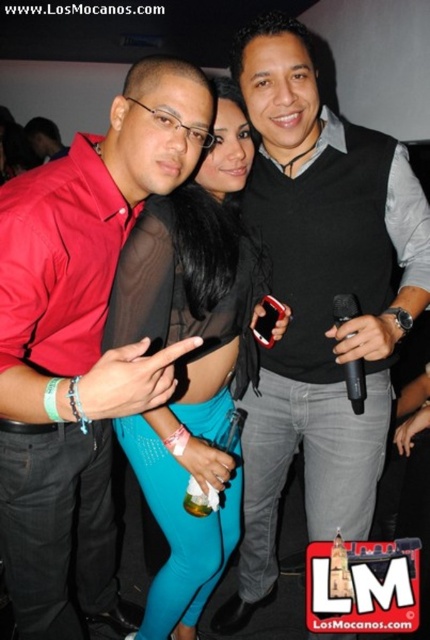
Question: Which object appears farthest from the camera in this image?

Choices:
 (A) black plastic microphone at right
 (B) satin black top at center
 (C) black matte vest at center

Answer: (A)

Question: Is matte red shirt at center to the left of black matte vest at center from the viewer's perspective?

Choices:
 (A) no
 (B) yes

Answer: (B)

Question: Is matte red shirt at center above satin black top at center?

Choices:
 (A) no
 (B) yes

Answer: (A)

Question: Does matte red shirt at center appear on the left side of black plastic microphone at right?

Choices:
 (A) yes
 (B) no

Answer: (A)

Question: Which is nearer to the matte red shirt at center?

Choices:
 (A) black matte vest at center
 (B) black plastic microphone at right
 (C) satin black top at center

Answer: (C)

Question: Which object appears farthest from the camera in this image?

Choices:
 (A) matte red shirt at center
 (B) black plastic microphone at right
 (C) satin black top at center

Answer: (B)